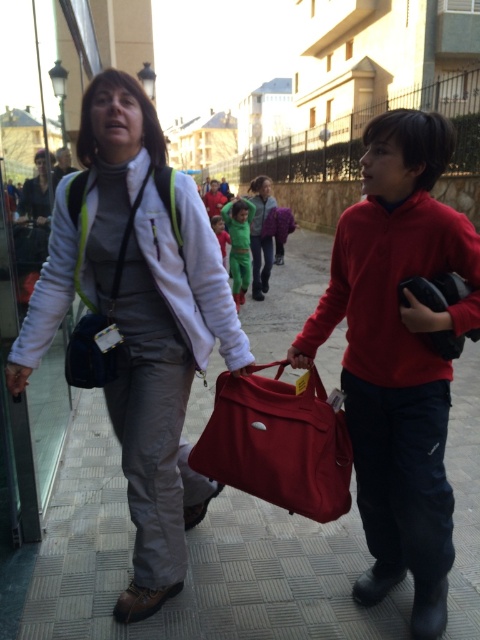
Is the position of matte white jacket at center more distant than that of matte red bag at center?

Yes, it is behind matte red bag at center.

Which is in front, point (180, 310) or point (380, 195)?

Positioned in front is point (380, 195).

I want to click on matte white jacket at center, so (139, 321).

Which is behind, point (117, 579) or point (256, 252)?

The point (256, 252) is behind.

Looking at this image, is matte concrete pavement at center below matte green jacket at center?

Indeed, matte concrete pavement at center is positioned under matte green jacket at center.

Which is behind, point (312, 289) or point (266, 276)?

Point (312, 289)

At what (x,y) coordinates should I click in order to perform the action: click on matte concrete pavement at center. Please return your answer as a coordinate pair (x, y). Image resolution: width=480 pixels, height=640 pixels. Looking at the image, I should click on click(x=195, y=561).

Between matte red bag at center and matte black bag at right, which one has less height?

matte black bag at right is shorter.

Who is taller, matte red bag at center or matte black bag at right?

matte red bag at center

At what (x,y) coordinates should I click in order to perform the action: click on matte red bag at center. Please return your answer as a coordinate pair (x, y). Looking at the image, I should click on (398, 355).